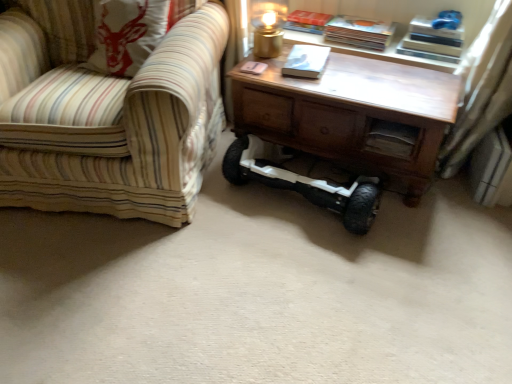
Question: From the image's perspective, is hardcover book at upper right, placed as the 2th book when sorted from back to front, above striped fabric chair at left?

Choices:
 (A) no
 (B) yes

Answer: (B)

Question: Is hardcover book at upper right, positioned as the second book in front-to-back order, directly adjacent to striped fabric chair at left?

Choices:
 (A) no
 (B) yes

Answer: (A)

Question: Would you consider hardcover book at upper right, positioned as the second book in front-to-back order, to be distant from striped fabric chair at left?

Choices:
 (A) yes
 (B) no

Answer: (A)

Question: From a real-world perspective, is hardcover book at upper right, positioned as the second book in front-to-back order, on top of striped fabric chair at left?

Choices:
 (A) no
 (B) yes

Answer: (B)

Question: From the image's perspective, is hardcover book at upper right, placed as the 2th book when sorted from back to front, beneath striped fabric chair at left?

Choices:
 (A) yes
 (B) no

Answer: (B)

Question: Is hardcover book at upper right, positioned as the second book in front-to-back order, positioned beyond the bounds of striped fabric chair at left?

Choices:
 (A) no
 (B) yes

Answer: (B)

Question: Is wooden drawer at center outside hardcover book at upper right, positioned as the second book in front-to-back order?

Choices:
 (A) no
 (B) yes

Answer: (B)

Question: Considering the relative sizes of wooden drawer at center and hardcover book at upper right, placed as the 2th book when sorted from back to front, in the image provided, is wooden drawer at center wider than hardcover book at upper right, placed as the 2th book when sorted from back to front,?

Choices:
 (A) no
 (B) yes

Answer: (A)

Question: Does wooden drawer at center have a lesser height compared to hardcover book at upper right, positioned as the second book in front-to-back order?

Choices:
 (A) yes
 (B) no

Answer: (B)

Question: Would you consider wooden drawer at center to be distant from hardcover book at upper right, positioned as the second book in front-to-back order?

Choices:
 (A) no
 (B) yes

Answer: (A)

Question: Is wooden drawer at center thinner than hardcover book at upper right, placed as the 2th book when sorted from back to front?

Choices:
 (A) no
 (B) yes

Answer: (B)

Question: Is wooden drawer at center to the left of hardcover book at upper right, placed as the 2th book when sorted from back to front, from the viewer's perspective?

Choices:
 (A) no
 (B) yes

Answer: (A)

Question: Are gold metallic table lamp at upper center and wooden table at center far apart?

Choices:
 (A) yes
 (B) no

Answer: (B)